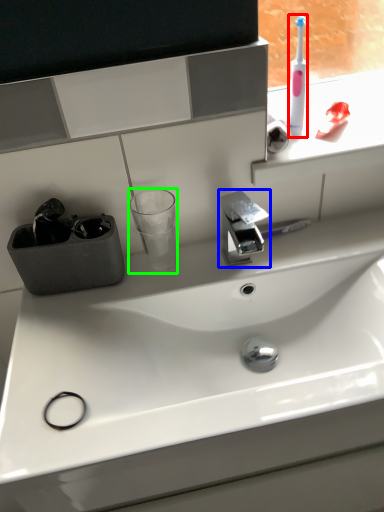
Question: Which object is the closest to the toothbrush (highlighted by a red box)? Choose among these: tap (highlighted by a blue box) or shot glass (highlighted by a green box).

Choices:
 (A) tap
 (B) shot glass

Answer: (A)